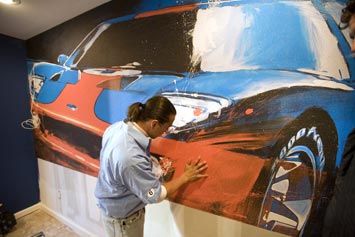
Identify the location of floor. Image resolution: width=355 pixels, height=237 pixels. pos(45,222).